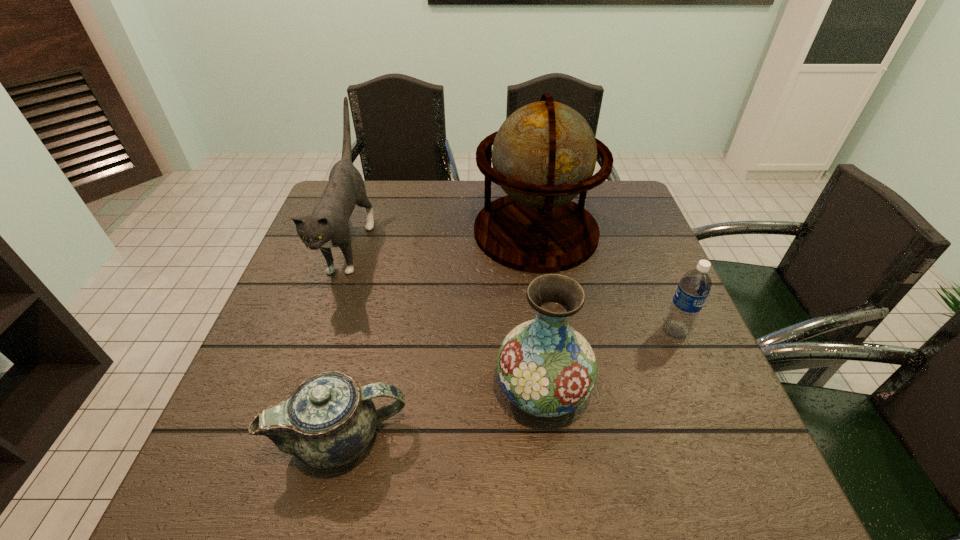
The image size is (960, 540). Find the location of `object situated at the far right corner`. object situated at the far right corner is located at coordinates (544, 154).

Where is `free point at the far edge`? The width and height of the screenshot is (960, 540). free point at the far edge is located at coordinates (391, 203).

Where is `vacant space at the near edge of the desktop`? vacant space at the near edge of the desktop is located at coordinates (561, 501).

This screenshot has height=540, width=960. In order to click on free space at the left edge of the desktop in this screenshot , I will do `click(248, 395)`.

You are a GUI agent. You are given a task and a screenshot of the screen. Output one action in this format:
    pyautogui.click(x=<x>, y=<y>)
    Task: Click on the free space at the right edge of the desktop
    Image resolution: width=960 pixels, height=540 pixels.
    Given the screenshot: What is the action you would take?
    pyautogui.click(x=713, y=427)

At what (x,y) coordinates should I click in order to perform the action: click on free location at the far right corner. Please return your answer as a coordinate pair (x, y). This screenshot has width=960, height=540. Looking at the image, I should click on (609, 223).

Find the location of `vacant space that is in between the chinaware and the third shortest object`. vacant space that is in between the chinaware and the third shortest object is located at coordinates (443, 413).

You are a GUI agent. You are given a task and a screenshot of the screen. Output one action in this format:
    pyautogui.click(x=<x>, y=<y>)
    Task: Click on the free space that is in between the vase and the second tallest object
    The width and height of the screenshot is (960, 540).
    Given the screenshot: What is the action you would take?
    pyautogui.click(x=446, y=315)

The width and height of the screenshot is (960, 540). In order to click on vacant region between the water bottle and the vase in this screenshot , I will do (x=609, y=360).

Locate an element on the screen. Image resolution: width=960 pixels, height=540 pixels. unoccupied position between the chinaware and the cat is located at coordinates (346, 340).